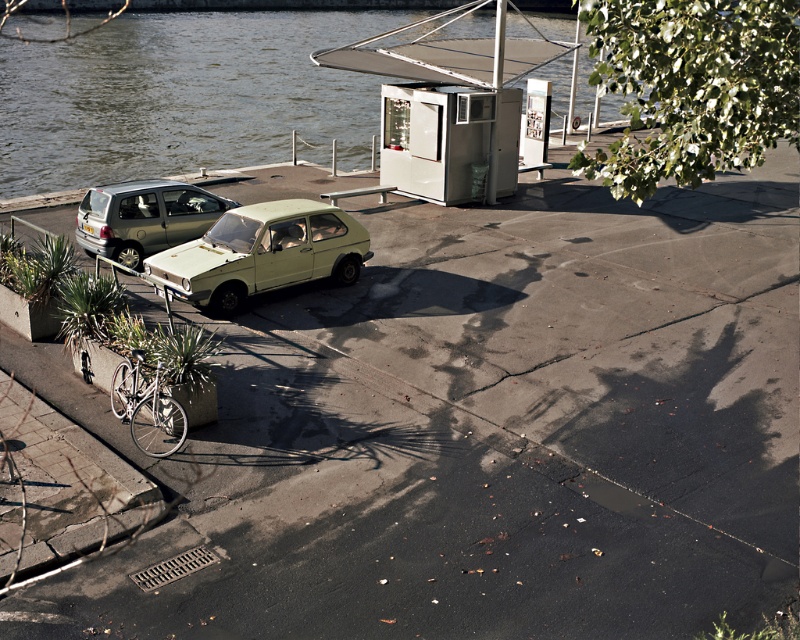
You are standing at the point marked as point (262, 253). What object is exactly at this location?

The light green matte car at center is located at point (262, 253).

You are a delivery person trying to access the bicycle parked against the concrete barrier. There are two cars blocking your path. The light green matte car at center and the matte green car at left. Which car do you need to move first to reach the bicycle?

The light green matte car at center is positioned under the matte green car at left, so you need to move the matte green car at left first to access the bicycle.

You are a delivery person trying to park your van between the light green matte car at center and the matte green car at left. The van is 5 meters long. Can you fit it there?

The light green matte car at center is bigger than matte green car at left, but the distance between them is not specified. Without knowing the space between the two cars, it is impossible to determine if the van can fit there.